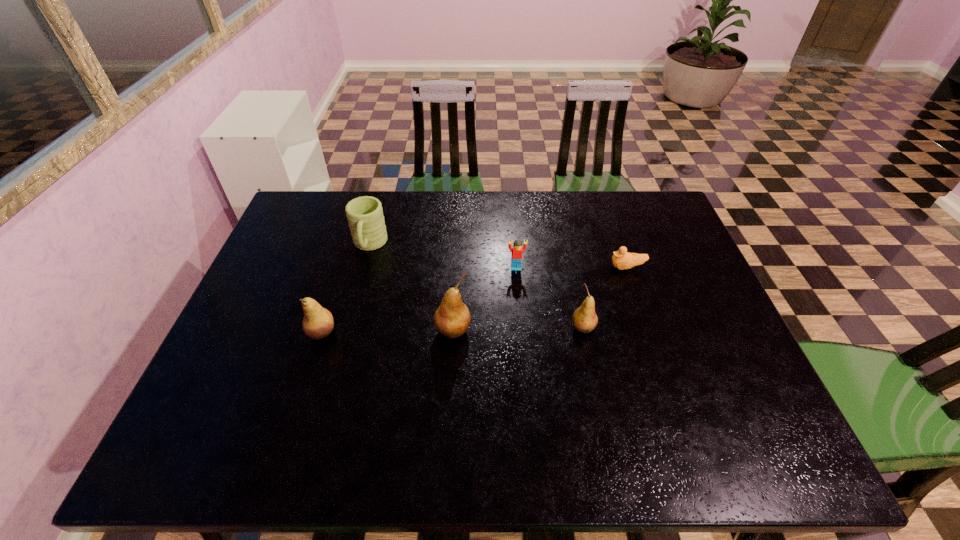
I want to click on blank area located on the right of the fifth shortest object, so click(392, 333).

I want to click on vacant space situated 0.100m on the left of the second pear from right to left, so click(396, 330).

Locate an element on the screen. vacant space positioned 0.070m on the right of the fifth object from left to right is located at coordinates (623, 328).

Where is `free spot located on the side of the mug with the handle`? The width and height of the screenshot is (960, 540). free spot located on the side of the mug with the handle is located at coordinates (356, 294).

Locate an element on the screen. Image resolution: width=960 pixels, height=540 pixels. free location located 0.080m on the face of the Lego is located at coordinates (517, 291).

The image size is (960, 540). Identify the location of vacant space located on the face of the rightmost object. (582, 267).

Identify the location of vacant space situated on the face of the rightmost object. This screenshot has height=540, width=960. point(483,267).

The image size is (960, 540). I want to click on free spot located on the face of the rightmost object, so click(579, 267).

The image size is (960, 540). In order to click on object that is at the far edge in this screenshot , I will do `click(365, 216)`.

Locate an element on the screen. object at the right edge is located at coordinates (621, 259).